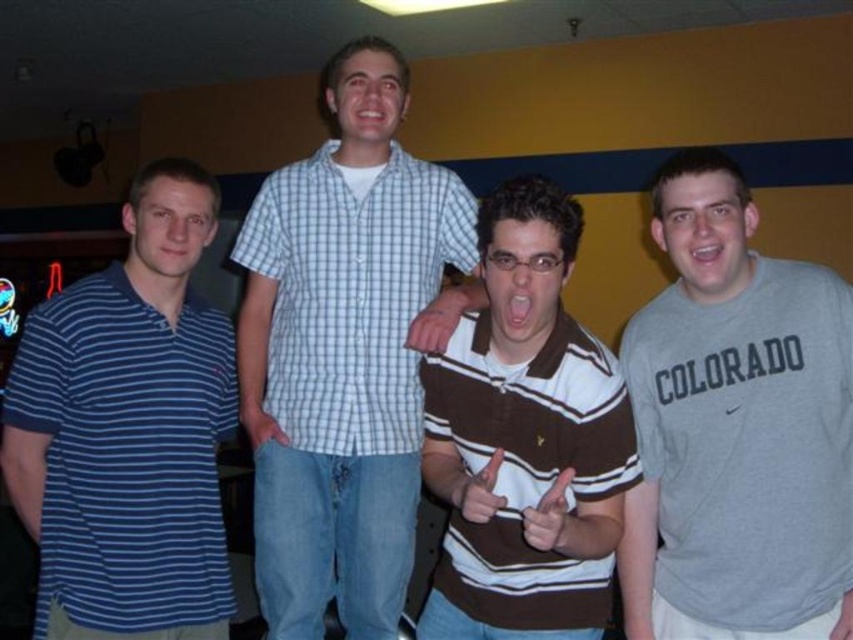
Question: Can you confirm if white checkered shirt at center is positioned above brown striped polo shirt at center?

Choices:
 (A) no
 (B) yes

Answer: (B)

Question: Can you confirm if white checkered shirt at center is positioned below brown striped polo shirt at center?

Choices:
 (A) no
 (B) yes

Answer: (A)

Question: Among these objects, which one is nearest to the camera?

Choices:
 (A) brown striped polo shirt at center
 (B) gray cotton t-shirt at right
 (C) white checkered shirt at center

Answer: (A)

Question: Which of the following is the closest to the observer?

Choices:
 (A) (329, 470)
 (B) (167, 349)
 (C) (653, 358)
 (D) (521, 378)

Answer: (D)

Question: Among these points, which one is nearest to the camera?

Choices:
 (A) (88, 634)
 (B) (328, 454)
 (C) (718, 401)
 (D) (556, 572)

Answer: (D)

Question: Observing the image, what is the correct spatial positioning of gray cotton t-shirt at right in reference to blue striped polo shirt at left?

Choices:
 (A) below
 (B) above

Answer: (A)